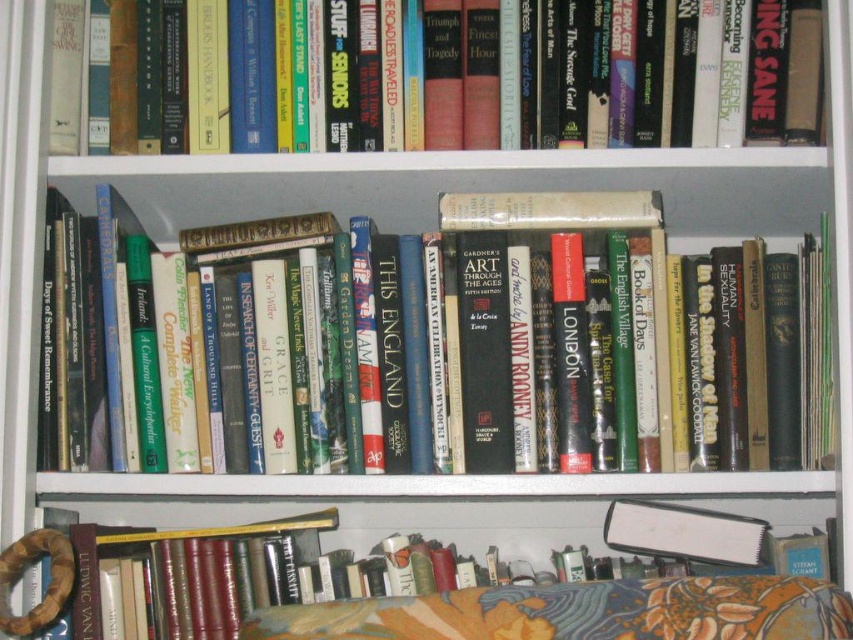
Question: Which of the following is the closest to the observer?

Choices:
 (A) hardcover books at center
 (B) hardcover book at upper center
 (C) floral fabric cushion at lower center
 (D) hardcover book at lower center

Answer: (C)

Question: Which object is positioned closest to the hardcover book at upper center?

Choices:
 (A) floral fabric cushion at lower center
 (B) hardcover books at center

Answer: (B)

Question: Observing the image, what is the correct spatial positioning of hardcover books at center in reference to hardcover book at lower center?

Choices:
 (A) below
 (B) above

Answer: (B)

Question: Does hardcover books at center appear on the right side of hardcover book at upper center?

Choices:
 (A) no
 (B) yes

Answer: (B)

Question: Which object appears farthest from the camera in this image?

Choices:
 (A) hardcover book at lower center
 (B) hardcover books at center
 (C) floral fabric cushion at lower center

Answer: (B)

Question: Does hardcover books at center have a lesser width compared to hardcover book at upper center?

Choices:
 (A) yes
 (B) no

Answer: (A)